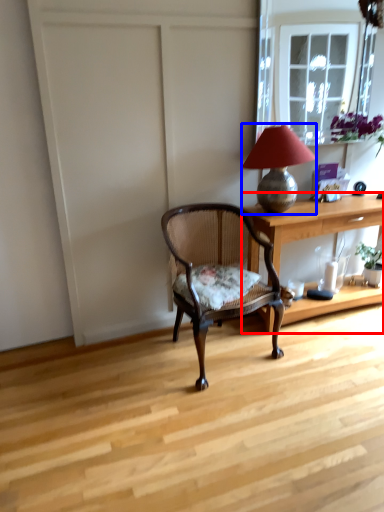
Question: Which object is closer to the camera taking this photo, desk (highlighted by a red box) or lamp (highlighted by a blue box)?

Choices:
 (A) desk
 (B) lamp

Answer: (B)